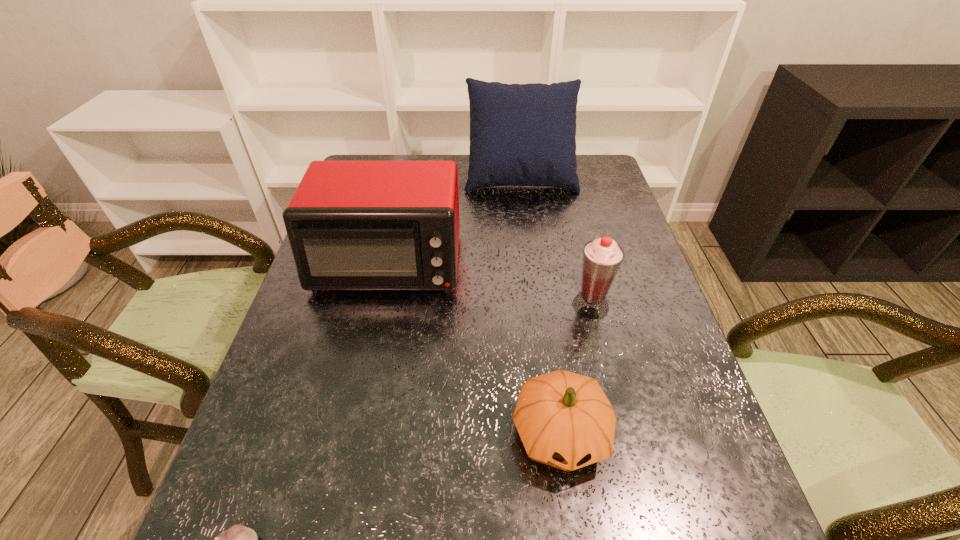
Locate which object is the second closest to the farthest object. Please provide its 2D coordinates. Your answer should be formatted as a tuple, i.e. [(x, y)], where the tuple contains the x and y coordinates of a point satisfying the conditions above.

[(602, 257)]

You are a GUI agent. You are given a task and a screenshot of the screen. Output one action in this format:
    pyautogui.click(x=<x>, y=<y>)
    Task: Click on the free space that satisfies the following two spatial constraints: 1. on the facing side of the farthest object; 2. on the right side of the smoothie
    
    Given the screenshot: What is the action you would take?
    pyautogui.click(x=537, y=306)

Locate an element on the screen. Image resolution: width=960 pixels, height=540 pixels. free location that satisfies the following two spatial constraints: 1. on the facing side of the smoothie; 2. on the right side of the tallest object is located at coordinates (537, 306).

You are a GUI agent. You are given a task and a screenshot of the screen. Output one action in this format:
    pyautogui.click(x=<x>, y=<y>)
    Task: Click on the vacant area that satisfies the following two spatial constraints: 1. on the facing side of the smoothie; 2. on the left side of the farthest object
    The height and width of the screenshot is (540, 960).
    Given the screenshot: What is the action you would take?
    pyautogui.click(x=537, y=306)